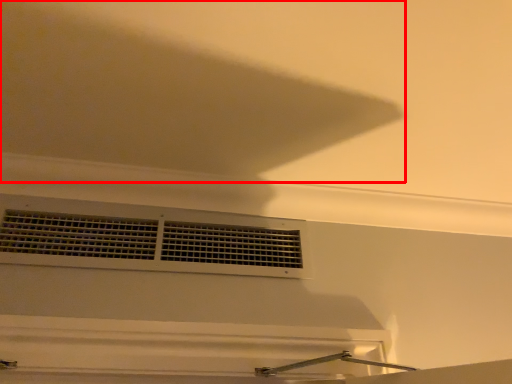
Question: Observing the image, what is the correct spatial positioning of exhaust hood (annotated by the red box) in reference to window?

Choices:
 (A) right
 (B) left

Answer: (A)